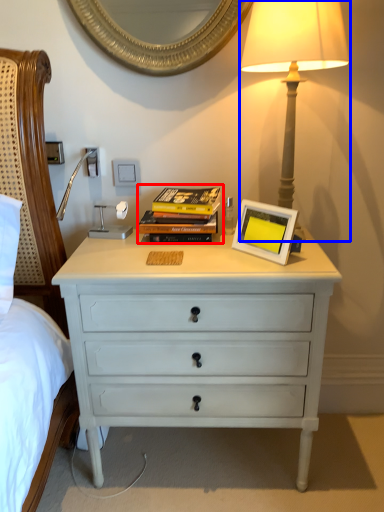
Question: Which of the following is the closest to the observer, magazine (highlighted by a red box) or bedside lamp (highlighted by a blue box)?

Choices:
 (A) magazine
 (B) bedside lamp

Answer: (B)